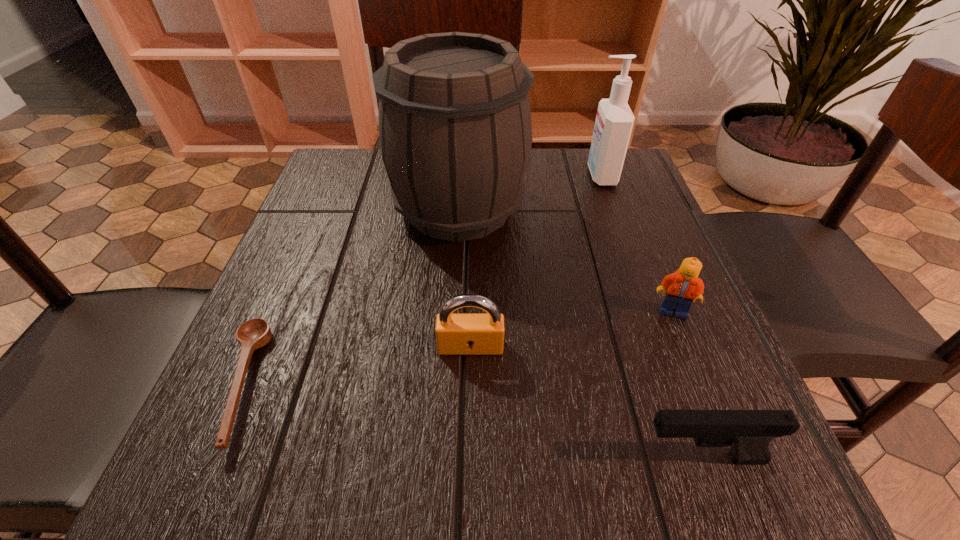
Identify the location of wooden spoon that is at the near edge. The width and height of the screenshot is (960, 540). (255, 333).

This screenshot has height=540, width=960. Identify the location of object situated at the left edge. (255, 333).

Identify the location of cleansing agent that is positioned at the right edge. Image resolution: width=960 pixels, height=540 pixels. (614, 121).

You are a GUI agent. You are given a task and a screenshot of the screen. Output one action in this format:
    pyautogui.click(x=<x>, y=<y>)
    Task: Click on the Lego that is at the right edge
    
    Given the screenshot: What is the action you would take?
    pyautogui.click(x=684, y=286)

Where is `pistol located in the right edge section of the desktop`? The height and width of the screenshot is (540, 960). pistol located in the right edge section of the desktop is located at coordinates (749, 433).

The width and height of the screenshot is (960, 540). Find the location of `object positioned at the near left corner`. object positioned at the near left corner is located at coordinates (255, 333).

This screenshot has height=540, width=960. What are the coordinates of `object located at the far right corner` in the screenshot? It's located at (614, 121).

What are the coordinates of `object located in the near right corner section of the desktop` in the screenshot? It's located at (749, 433).

Locate an element on the screen. The width and height of the screenshot is (960, 540). vacant area at the far edge of the desktop is located at coordinates (543, 172).

At what (x,y) coordinates should I click in order to perform the action: click on vacant region at the near edge of the desktop. Please return your answer as a coordinate pair (x, y). The image size is (960, 540). Looking at the image, I should click on (540, 492).